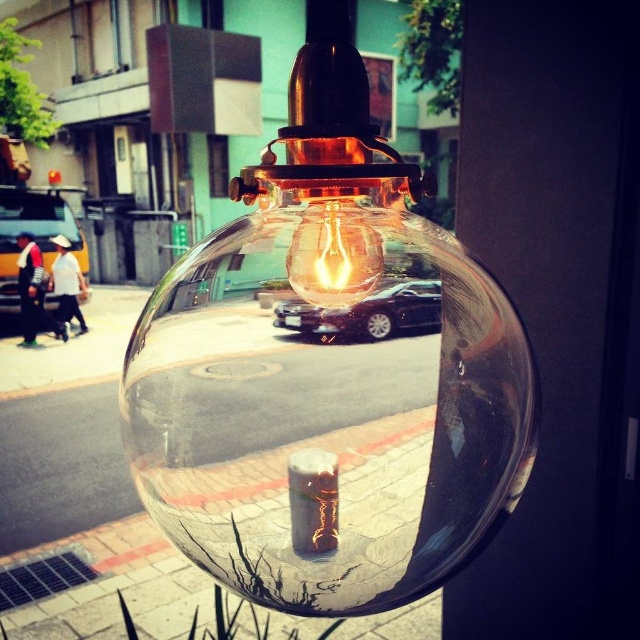
You are standing in a room with a transparent glass globe at center. If you want to place a small plant exactly where the globe is reflected in the glass, where should you put it?

The transparent glass globe at center is reflected at position point (328, 403), so you should place the small plant at that exact coordinate.

You are standing in a room with a large light fixture. You notice two objects at the center of the image, the transparent glass globe at center and the translucent glass bulb at center. Based on their positions, which one do you think is closer to you?

The transparent glass globe at center is in front of the translucent glass bulb at center, so it is closer to you.